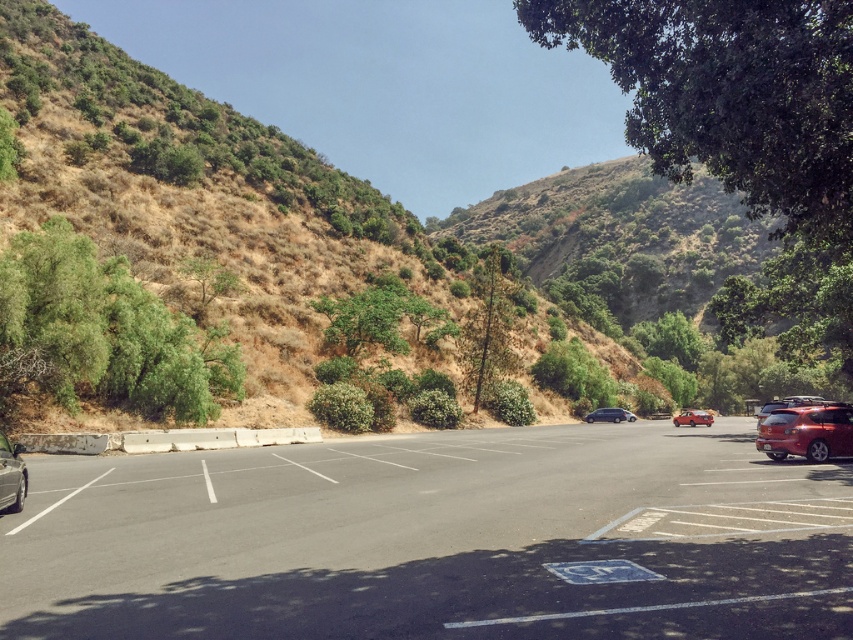
Between black asphalt parking lot at center and dried grass at center, which one has less height?

Standing shorter between the two is black asphalt parking lot at center.

Locate an element on the screen. Image resolution: width=853 pixels, height=640 pixels. black asphalt parking lot at center is located at coordinates (439, 540).

Find the location of a particular element. black asphalt parking lot at center is located at coordinates (439, 540).

The width and height of the screenshot is (853, 640). Describe the element at coordinates (195, 248) in the screenshot. I see `dried grass at center` at that location.

Between dried grass at center and green leafy tree at left, which one appears on the left side from the viewer's perspective?

Positioned to the left is green leafy tree at left.

Between point (61, 176) and point (33, 321), which one is positioned in front?

Point (33, 321)

I want to click on dried grass at center, so click(195, 248).

Describe the element at coordinates (105, 332) in the screenshot. I see `green leafy tree at left` at that location.

Which is more to the right, green leafy tree at left or metallic silver car at left?

metallic silver car at left

Between point (178, 332) and point (6, 477), which one is positioned behind?

Point (178, 332)

Identify the location of green leafy tree at left. The image size is (853, 640). (105, 332).